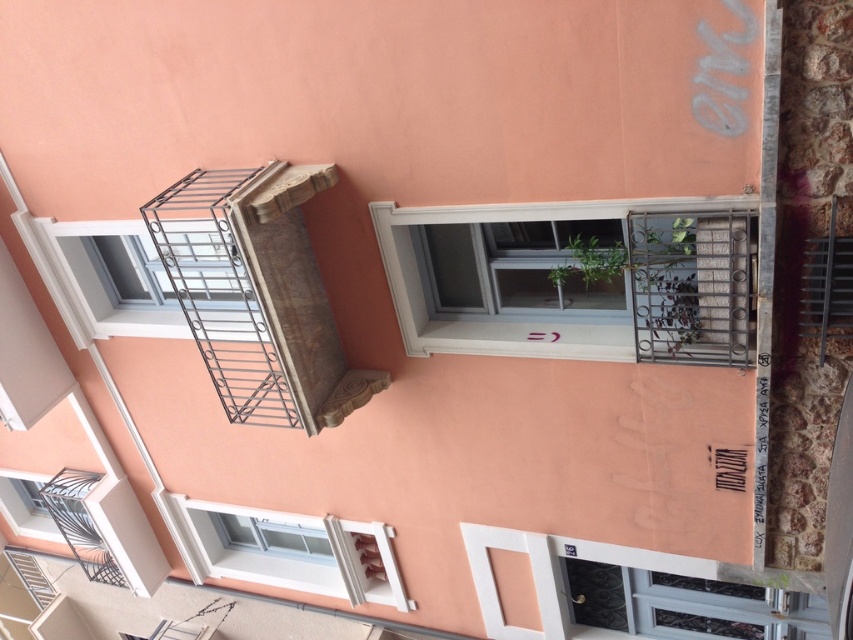
Question: Is the position of metallic gray fire escape at upper left less distant than that of white glossy window at lower left?

Choices:
 (A) yes
 (B) no

Answer: (A)

Question: Estimate the real-world distances between objects in this image. Which object is farther from the metallic gray fire escape at upper left?

Choices:
 (A) metallic silver balcony at lower left
 (B) white glossy window at lower left

Answer: (A)

Question: Where is white glossy window at lower left located in relation to metallic silver balcony at upper left in the image?

Choices:
 (A) right
 (B) left

Answer: (A)

Question: Which object is the farthest from the metallic silver balcony at lower left?

Choices:
 (A) metallic silver balcony at upper left
 (B) white glossy window at lower left

Answer: (A)

Question: Is white plastic window at center to the right of metallic silver balcony at lower left from the viewer's perspective?

Choices:
 (A) yes
 (B) no

Answer: (A)

Question: Which object is closer to the camera taking this photo?

Choices:
 (A) metallic gray fire escape at upper left
 (B) metallic silver balcony at lower left
 (C) white plastic window at center
 (D) white glossy window at lower left

Answer: (C)